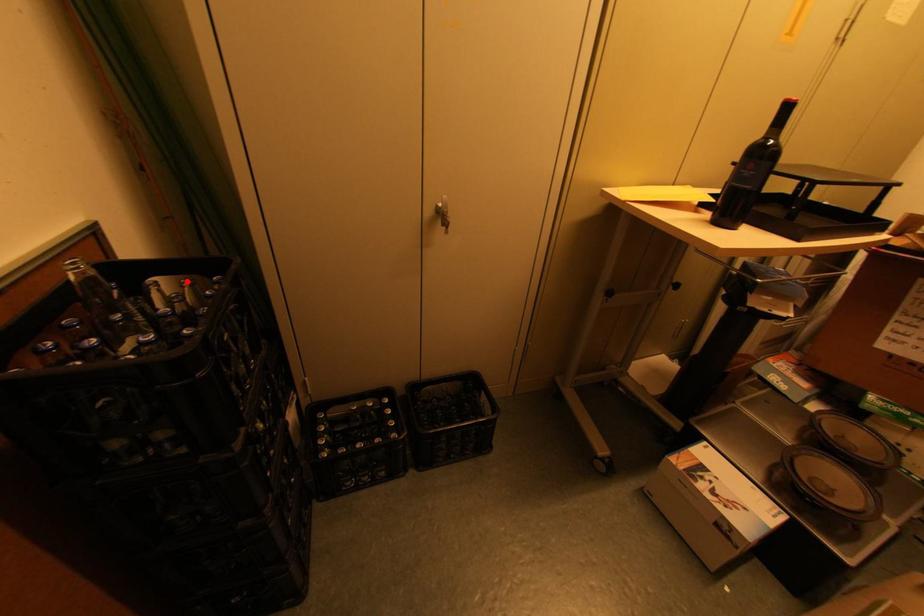
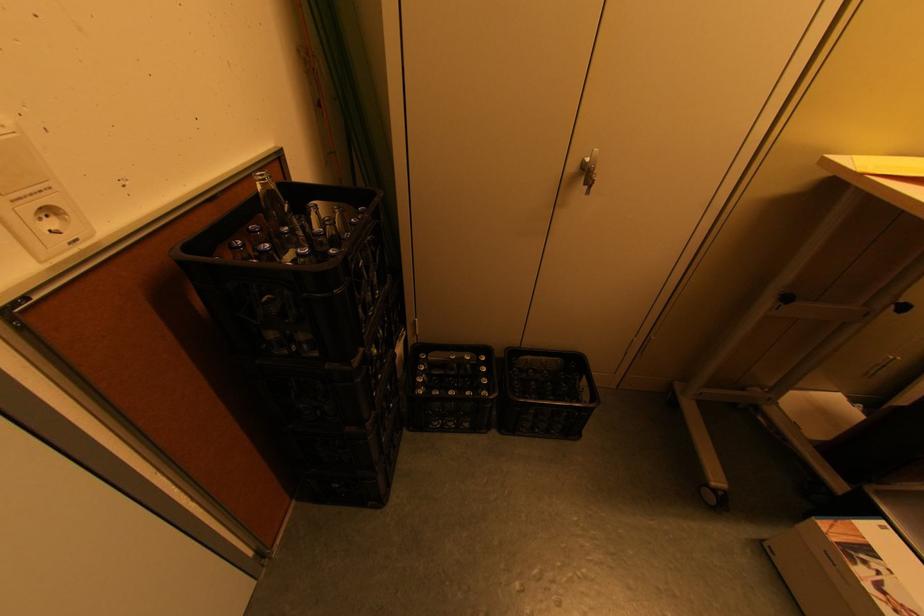
The point at the highlighted location is marked in the first image. Where is the corresponding point in the second image?

(338, 208)